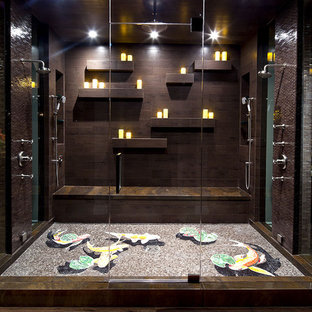
Where is `shower control`? shower control is located at coordinates (25, 157), (280, 160).